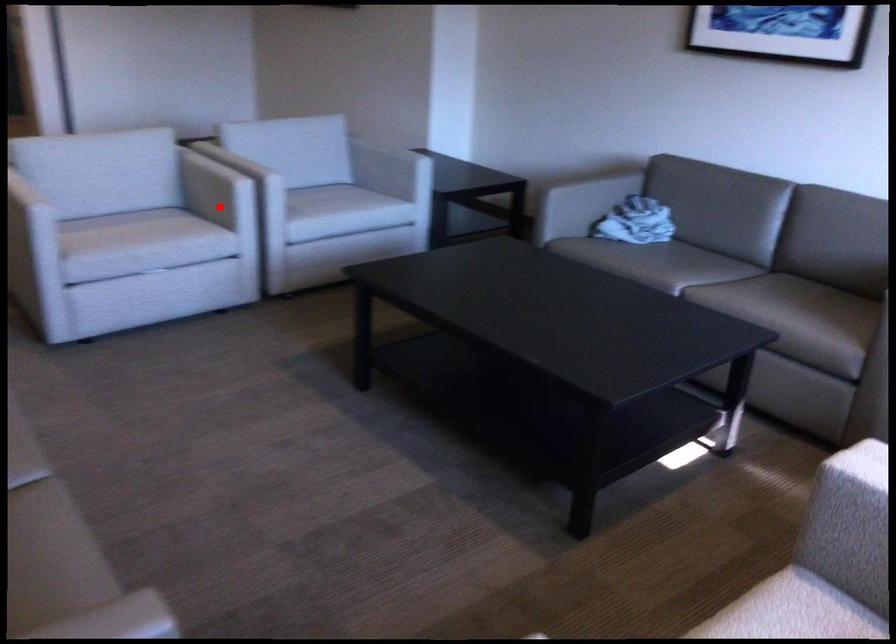
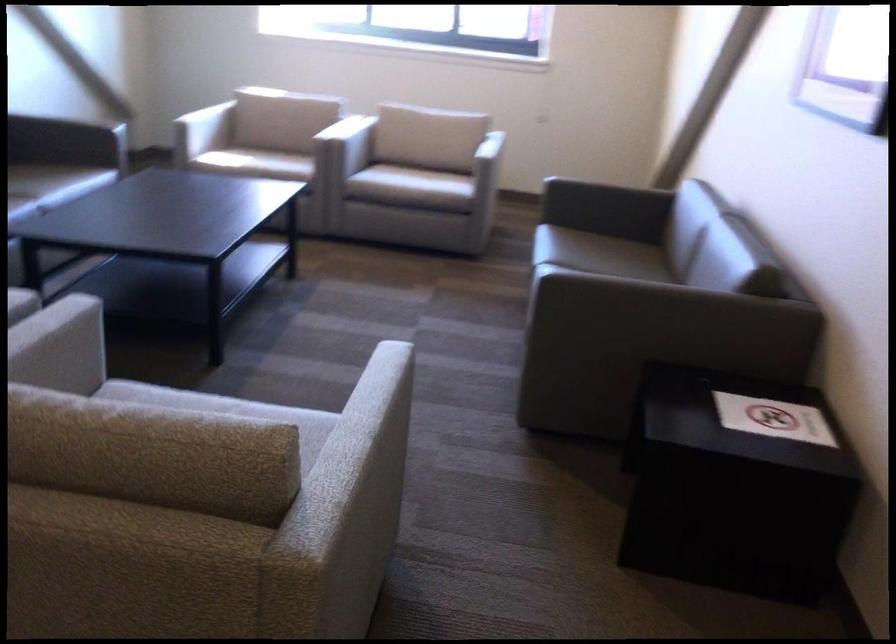
Question: I am providing you with two images of the same scene from different viewpoints. Given a red point in image1, look at the same physical point in image2. Is it:

Choices:
 (A) Closer to the viewpoint
 (B) Farther from the viewpoint

Answer: (A)